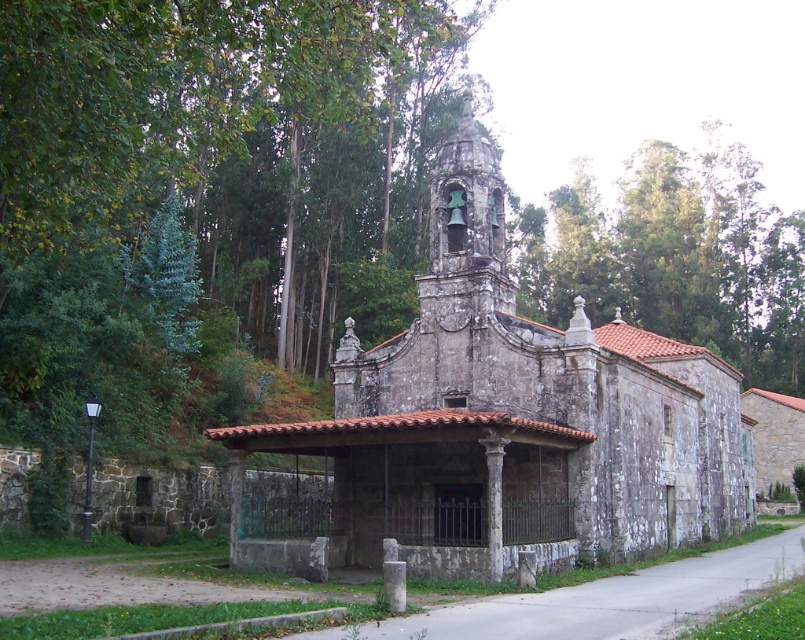
Question: Does stone church at center appear on the left side of green leafy tree at upper center?

Choices:
 (A) yes
 (B) no

Answer: (A)

Question: Does stone church at center lie in front of green leafy tree at upper center?

Choices:
 (A) no
 (B) yes

Answer: (B)

Question: Which object is farther from the camera taking this photo?

Choices:
 (A) stone church at center
 (B) green leafy tree at upper center

Answer: (B)

Question: Can you confirm if stone church at center is positioned to the left of green leafy tree at upper center?

Choices:
 (A) yes
 (B) no

Answer: (A)

Question: Which point is closer to the camera?

Choices:
 (A) (550, 282)
 (B) (650, 497)

Answer: (B)